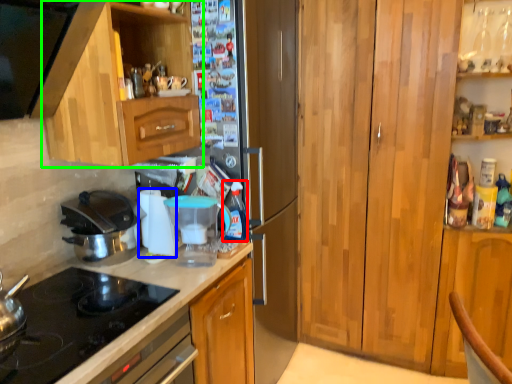
Question: Estimate the real-world distances between objects in this image. Which object is closer to bottle (highlighted by a red box), appliance (highlighted by a blue box) or cabinetry (highlighted by a green box)?

Choices:
 (A) appliance
 (B) cabinetry

Answer: (A)